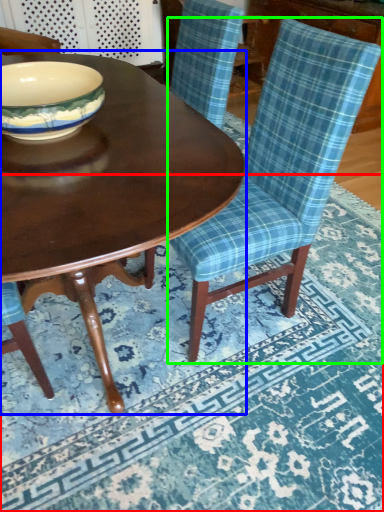
Question: Considering the real-world distances, which object is closest to place mat (highlighted by a red box)? coffee table (highlighted by a blue box) or chair (highlighted by a green box).

Choices:
 (A) coffee table
 (B) chair

Answer: (B)